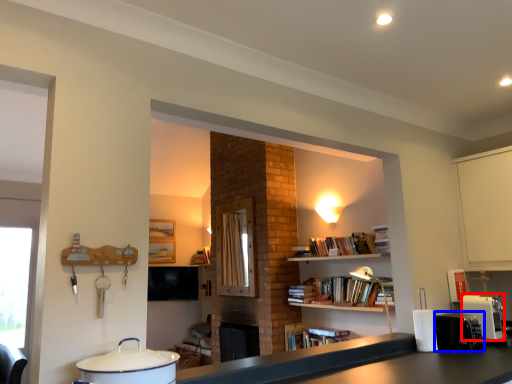
Question: Which of the following is the farthest to the observer, coffee machine (highlighted by a red box) or appliance (highlighted by a blue box)?

Choices:
 (A) coffee machine
 (B) appliance

Answer: (A)